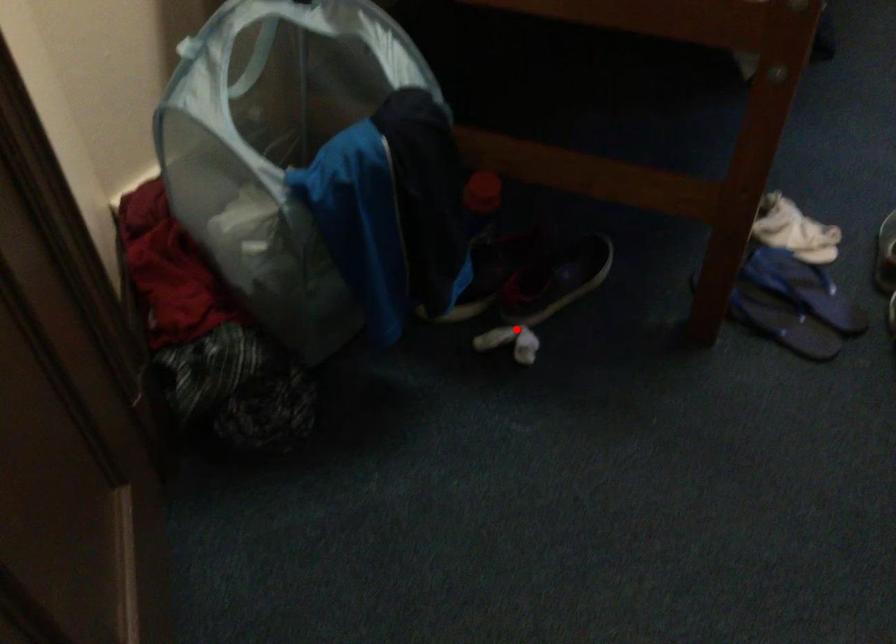
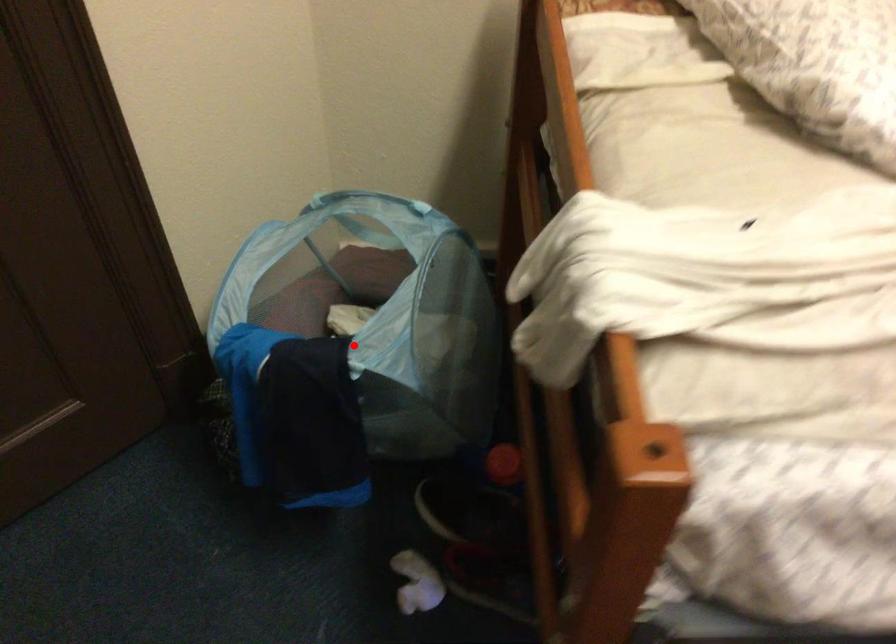
I am providing you with two images of the same scene from different viewpoints. A red point is marked on the first image and another point is marked on the second image. Are the points marked in image1 and image2 representing the same 3D position?

No